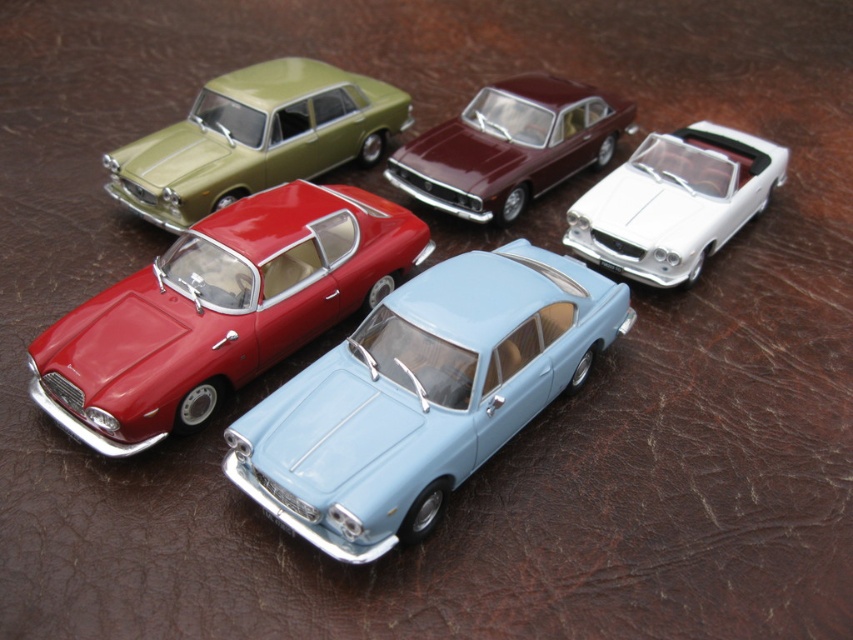
Is light blue metallic car at center positioned at the back of glossy red car at center-left?

No, light blue metallic car at center is in front of glossy red car at center-left.

Can you confirm if light blue metallic car at center is bigger than glossy red car at center-left?

Yes.

Between point (311, 456) and point (193, 291), which one is positioned behind?

Positioned behind is point (193, 291).

This screenshot has width=853, height=640. Identify the location of light blue metallic car at center. (422, 396).

Does light blue metallic car at center have a smaller size compared to white glossy convertible at upper right?

No.

Does light blue metallic car at center come behind white glossy convertible at upper right?

No, light blue metallic car at center is in front of white glossy convertible at upper right.

Is point (593, 346) farther from viewer compared to point (663, 284)?

No, it is in front of (663, 284).

Where is `light blue metallic car at center`? This screenshot has width=853, height=640. light blue metallic car at center is located at coordinates (422, 396).

Between glossy red car at center-left and white glossy convertible at upper right, which one has less height?

white glossy convertible at upper right is shorter.

Where is `glossy red car at center-left`? glossy red car at center-left is located at coordinates (218, 310).

At what (x,y) coordinates should I click in order to perform the action: click on glossy red car at center-left. Please return your answer as a coordinate pair (x, y). The image size is (853, 640). Looking at the image, I should click on (218, 310).